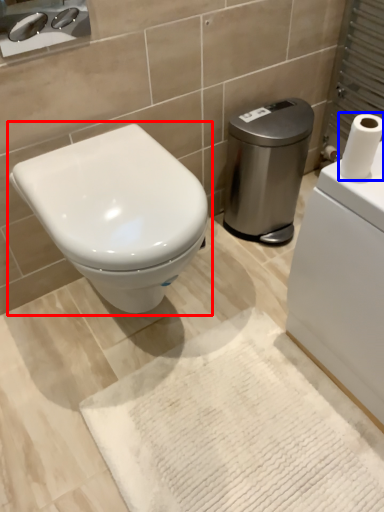
Question: Among these objects, which one is farthest to the camera, toilet (highlighted by a red box) or toilet paper (highlighted by a blue box)?

Choices:
 (A) toilet
 (B) toilet paper

Answer: (A)